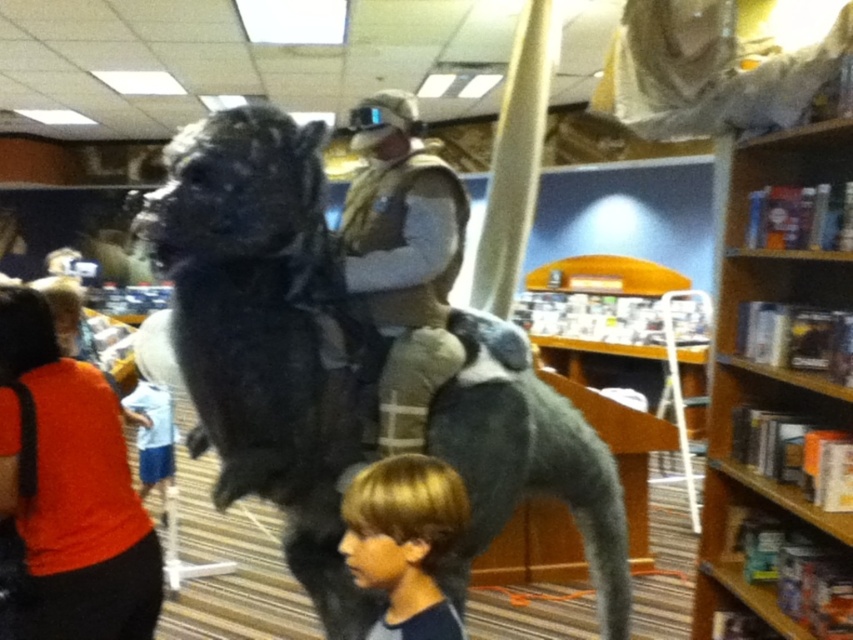
From the picture: Does wooden bookshelf at right appear over tan fabric vest at center?

No.

Is wooden bookshelf at right below tan fabric vest at center?

Indeed, wooden bookshelf at right is positioned under tan fabric vest at center.

Locate an element on the screen. wooden bookshelf at right is located at coordinates (769, 372).

Which is behind, point (326, 349) or point (775, 170)?

The point (775, 170) is more distant.

Identify the location of furry black creature at center. (270, 333).

Describe the element at coordinates (270, 333) in the screenshot. I see `furry black creature at center` at that location.

Who is more forward, (363, 458) or (13, 492)?

Point (13, 492)

I want to click on furry black creature at center, so pos(270,333).